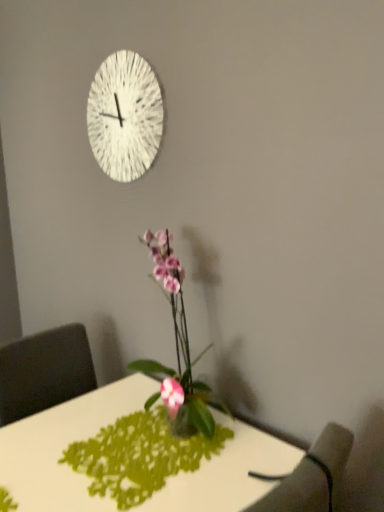
Question: Is dark gray fabric armchair at lower right in front of pink glossy orchid at center?

Choices:
 (A) no
 (B) yes

Answer: (B)

Question: Is dark gray fabric armchair at lower right bigger than pink glossy orchid at center?

Choices:
 (A) no
 (B) yes

Answer: (A)

Question: From a real-world perspective, is dark gray fabric armchair at lower right under pink glossy orchid at center?

Choices:
 (A) no
 (B) yes

Answer: (B)

Question: Is dark gray fabric armchair at lower right facing towards pink glossy orchid at center?

Choices:
 (A) yes
 (B) no

Answer: (B)

Question: Does dark gray fabric armchair at lower right have a greater height compared to pink glossy orchid at center?

Choices:
 (A) yes
 (B) no

Answer: (B)

Question: Is white glossy desk at center bigger or smaller than dark gray fabric armchair at lower right?

Choices:
 (A) big
 (B) small

Answer: (A)

Question: Is white glossy desk at center wider or thinner than dark gray fabric armchair at lower right?

Choices:
 (A) wide
 (B) thin

Answer: (A)

Question: Is white glossy desk at center spatially inside dark gray fabric armchair at lower right, or outside of it?

Choices:
 (A) outside
 (B) inside

Answer: (A)

Question: Based on their positions, is white glossy desk at center located to the left or right of dark gray fabric armchair at lower right?

Choices:
 (A) right
 (B) left

Answer: (B)

Question: Is white textured clock at upper center to the left or to the right of white glossy desk at center in the image?

Choices:
 (A) left
 (B) right

Answer: (A)

Question: From a real-world perspective, is white textured clock at upper center positioned above or below white glossy desk at center?

Choices:
 (A) below
 (B) above

Answer: (B)

Question: Considering the positions of point (114, 180) and point (271, 437), is point (114, 180) closer or farther from the camera than point (271, 437)?

Choices:
 (A) farther
 (B) closer

Answer: (A)

Question: Looking at their shapes, would you say white textured clock at upper center is wider or thinner than white glossy desk at center?

Choices:
 (A) thin
 (B) wide

Answer: (A)

Question: Is pink glossy orchid at center taller or shorter than white glossy desk at center?

Choices:
 (A) tall
 (B) short

Answer: (B)

Question: Considering the positions of point (148, 402) and point (82, 503), is point (148, 402) closer or farther from the camera than point (82, 503)?

Choices:
 (A) farther
 (B) closer

Answer: (A)